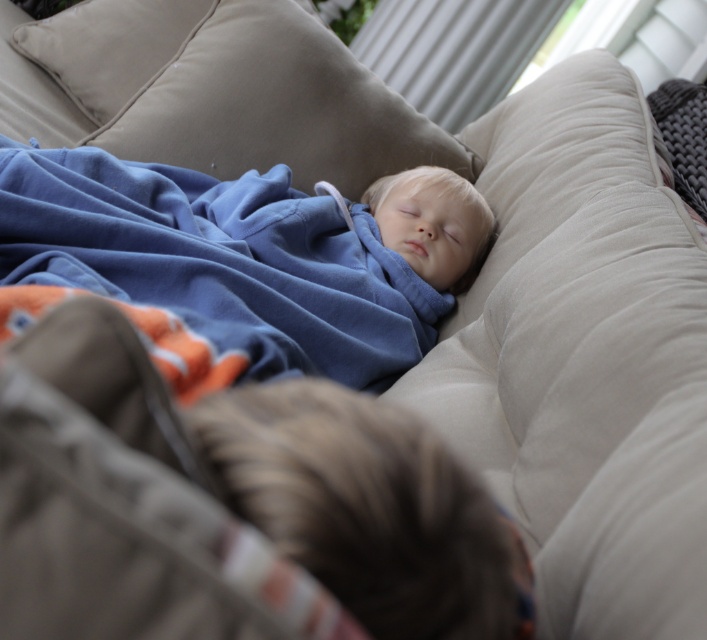
Question: Is orange cotton blanket at center positioned in front of beige velvety pillow at upper left?

Choices:
 (A) no
 (B) yes

Answer: (B)

Question: Which object is closer to the camera taking this photo?

Choices:
 (A) orange cotton blanket at center
 (B) beige velvety pillow at upper left
 (C) fluffy brown hair at center

Answer: (A)

Question: Which point appears farthest from the camera in this image?

Choices:
 (A) (199, 301)
 (B) (62, 360)

Answer: (A)

Question: Does orange cotton blanket at center appear on the right side of beige fabric pillow at upper center?

Choices:
 (A) yes
 (B) no

Answer: (A)

Question: Which point is closer to the camera?

Choices:
 (A) orange cotton blanket at center
 (B) beige fabric pillow at upper center

Answer: (A)

Question: Does blue fleece blanket at upper center appear over orange cotton blanket at center?

Choices:
 (A) yes
 (B) no

Answer: (A)